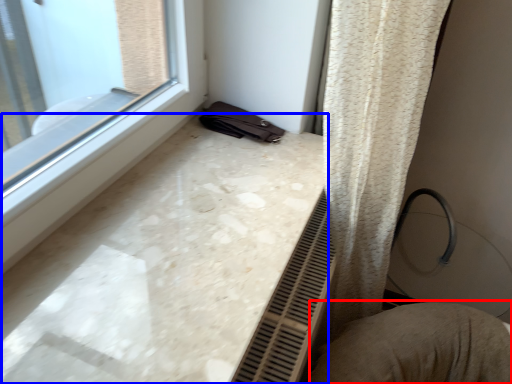
Question: Which object appears farthest to the camera in this image, swivel chair (highlighted by a red box) or counter top (highlighted by a blue box)?

Choices:
 (A) swivel chair
 (B) counter top

Answer: (A)